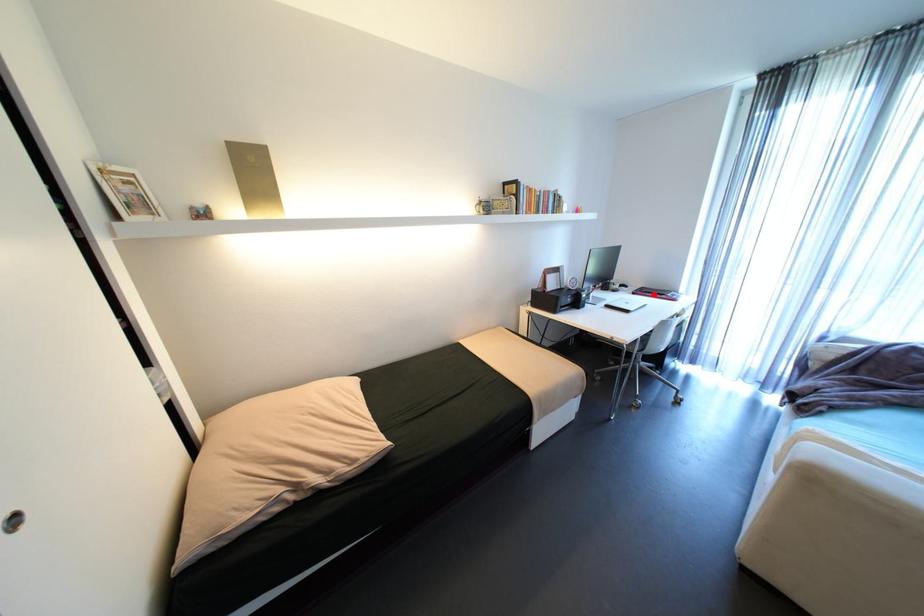
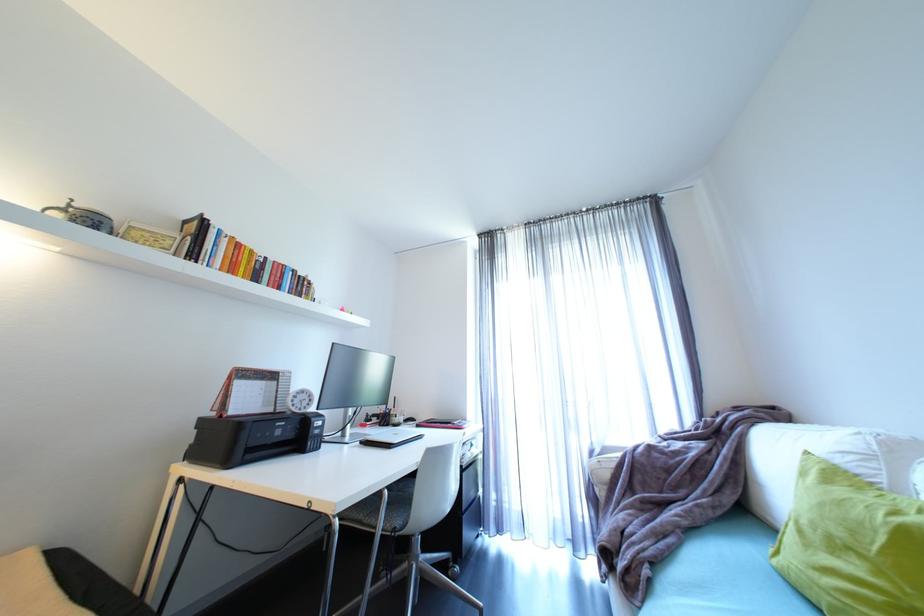
Where in the second image is the point corresponding to the highlighted location from the first image?

(440, 424)